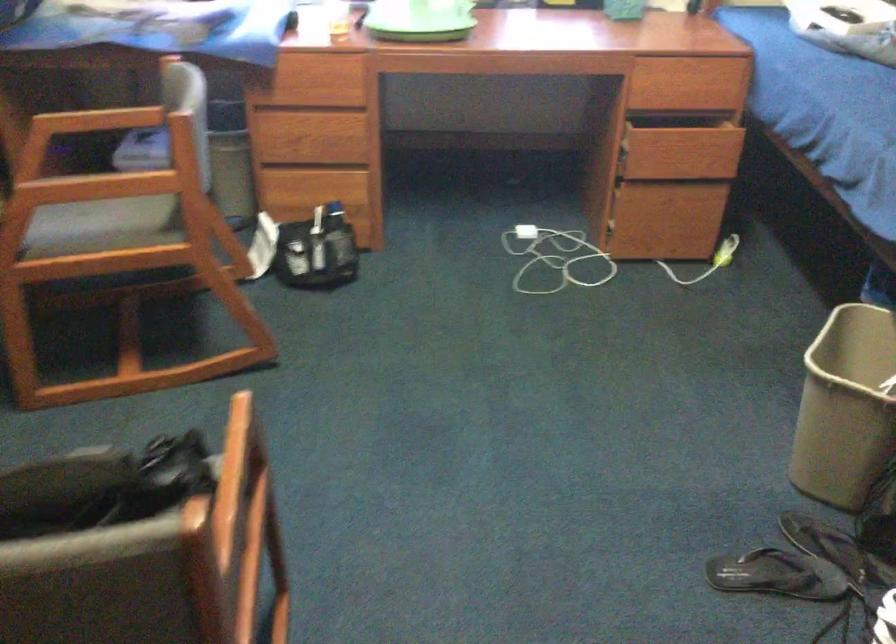
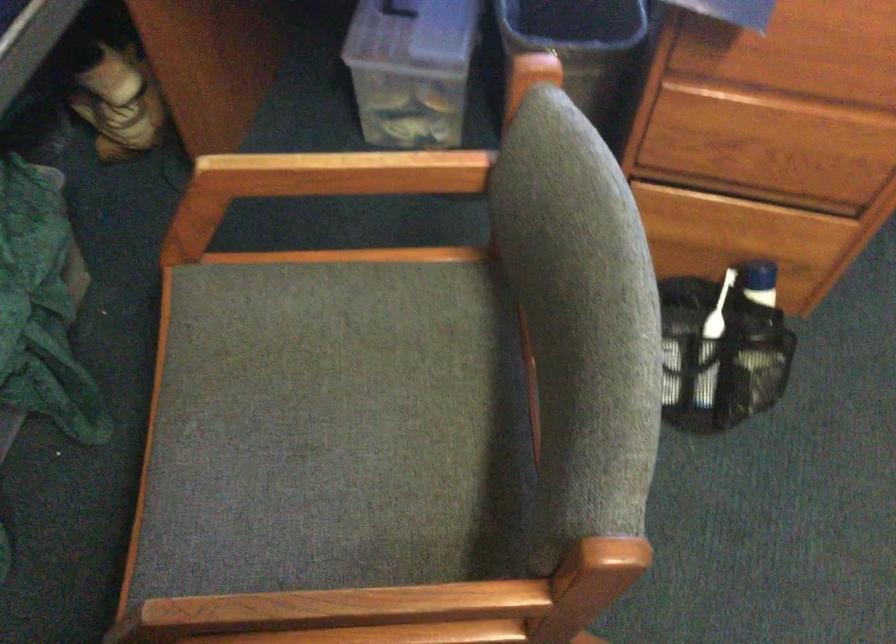
In the scene shown: The images are taken continuously from a first-person perspective. In which direction are you moving?

The cameraman moved toward left, forward.